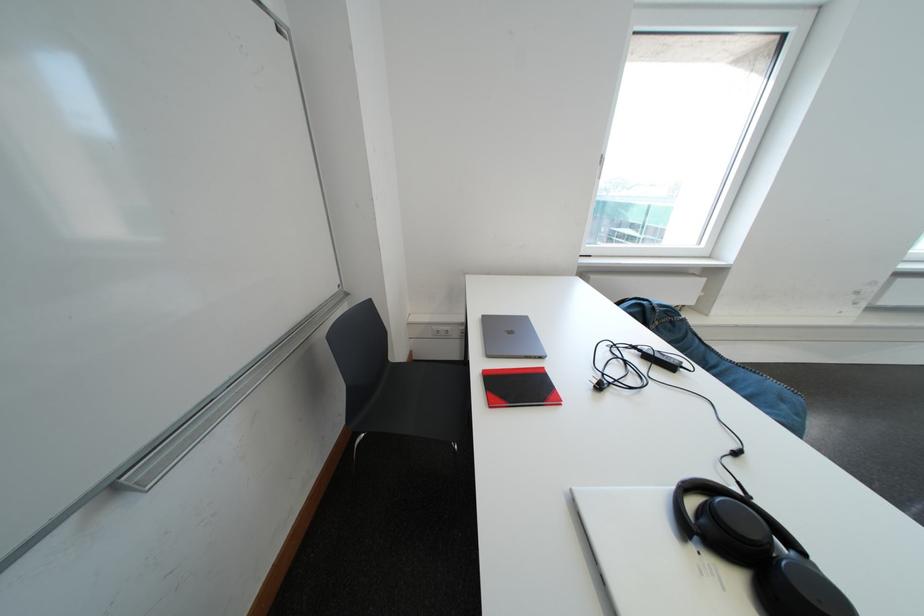
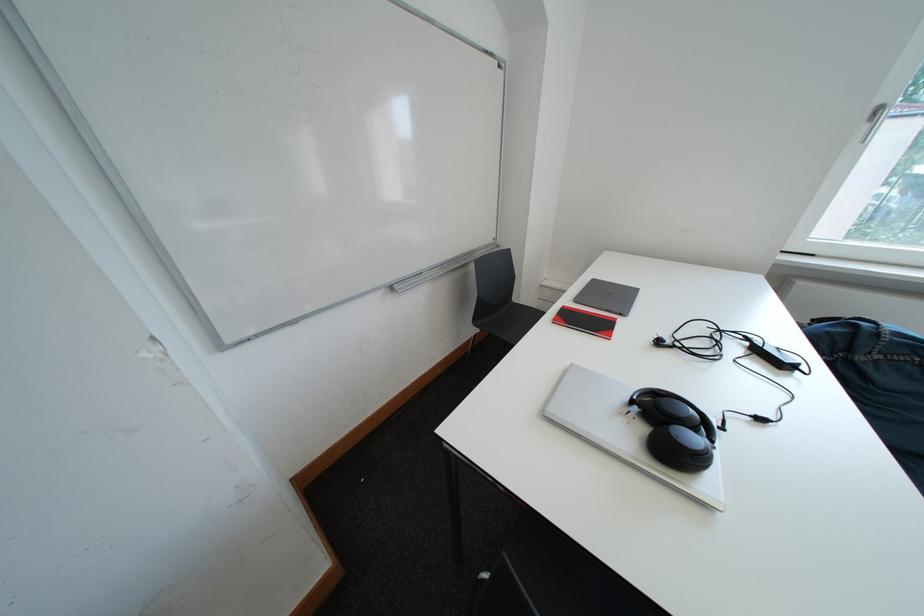
In the second image, find the point that corresponds to the point at 124,491 in the first image.

(403, 292)